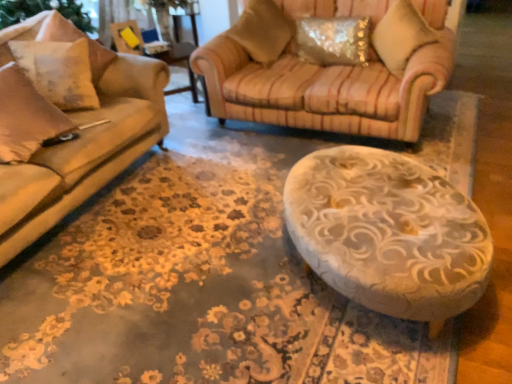
What do you see at coordinates (262, 30) in the screenshot? The height and width of the screenshot is (384, 512). I see `textured beige pillow at upper center, acting as the third pillow starting from the right` at bounding box center [262, 30].

This screenshot has width=512, height=384. I want to click on yellow plastic swivel chair at upper left, so click(x=127, y=37).

The image size is (512, 384). I want to click on sparkly metallic pillow at upper right, which is counted as the second pillow, starting from the right, so click(x=333, y=40).

Is textured beige pillow at upper center, the 2th pillow viewed from the left, smaller than velvet striped pillow at upper right, which appears as the first pillow when viewed from the right?

Actually, textured beige pillow at upper center, the 2th pillow viewed from the left, might be larger than velvet striped pillow at upper right, which appears as the first pillow when viewed from the right.

How many degrees apart are the facing directions of textured beige pillow at upper center, acting as the third pillow starting from the right, and velvet striped pillow at upper right, which appears as the first pillow when viewed from the right?

The facing directions of textured beige pillow at upper center, acting as the third pillow starting from the right, and velvet striped pillow at upper right, which appears as the first pillow when viewed from the right, are 81.5 degrees apart.

Which is farther from the camera, (249, 6) or (372, 33)?

Point (249, 6)

Does textured beige pillow at upper center, the 2th pillow viewed from the left, come in front of velvet striped pillow at upper right, which appears as the first pillow when viewed from the right?

No, textured beige pillow at upper center, the 2th pillow viewed from the left, is behind velvet striped pillow at upper right, which appears as the first pillow when viewed from the right.

Is velvet striped pillow at upper right, which appears as the first pillow when viewed from the right, bigger than textured beige pillow at upper center, the 2th pillow viewed from the left?

Incorrect, velvet striped pillow at upper right, which appears as the first pillow when viewed from the right, is not larger than textured beige pillow at upper center, the 2th pillow viewed from the left.

Which object is positioned more to the right, velvet striped pillow at upper right, which appears as the first pillow when viewed from the right, or textured beige pillow at upper center, the 2th pillow viewed from the left?

Positioned to the right is velvet striped pillow at upper right, which appears as the first pillow when viewed from the right.

Which is in front, point (429, 29) or point (247, 29)?

The point (429, 29) is closer.

Considering the sizes of objects velvet striped pillow at upper right, which appears as the first pillow when viewed from the right, and textured beige pillow at upper center, the 2th pillow viewed from the left, in the image provided, who is taller, velvet striped pillow at upper right, which appears as the first pillow when viewed from the right, or textured beige pillow at upper center, the 2th pillow viewed from the left,?

textured beige pillow at upper center, the 2th pillow viewed from the left.

Considering the sizes of textured beige pillow at upper center, the 2th pillow viewed from the left, and white textured pillow at left, arranged as the 1th pillow when viewed from the left, in the image, is textured beige pillow at upper center, the 2th pillow viewed from the left, wider or thinner than white textured pillow at left, arranged as the 1th pillow when viewed from the left,?

Clearly, textured beige pillow at upper center, the 2th pillow viewed from the left, has more width compared to white textured pillow at left, arranged as the 1th pillow when viewed from the left.

Considering the relative positions of textured beige pillow at upper center, the 2th pillow viewed from the left, and white textured pillow at left, arranged as the 1th pillow when viewed from the left, in the image provided, is textured beige pillow at upper center, the 2th pillow viewed from the left, to the left of white textured pillow at left, arranged as the 1th pillow when viewed from the left, from the viewer's perspective?

Incorrect, textured beige pillow at upper center, the 2th pillow viewed from the left, is not on the left side of white textured pillow at left, arranged as the 1th pillow when viewed from the left.

Between point (265, 17) and point (30, 47), which one is positioned in front?

The point (30, 47) is more forward.

Is textured beige pillow at upper center, the 2th pillow viewed from the left, positioned far away from white textured pillow at left, which is the 4th pillow in right-to-left order?

Yes.

From a real-world perspective, which is physically above, textured beige pillow at upper center, the 2th pillow viewed from the left, or yellow plastic swivel chair at upper left?

yellow plastic swivel chair at upper left.

Who is more distant, textured beige pillow at upper center, the 2th pillow viewed from the left, or yellow plastic swivel chair at upper left?

yellow plastic swivel chair at upper left is more distant.

Who is taller, textured beige pillow at upper center, the 2th pillow viewed from the left, or yellow plastic swivel chair at upper left?

textured beige pillow at upper center, the 2th pillow viewed from the left, is taller.

Does point (251, 19) lie behind point (129, 53)?

No, (251, 19) is closer to viewer.

From a real-world perspective, between velvet striped pillow at upper right, which is the 4th pillow in left-to-right order, and yellow plastic swivel chair at upper left, who is vertically higher?

velvet striped pillow at upper right, which is the 4th pillow in left-to-right order, is physically above.

Considering the positions of objects velvet striped pillow at upper right, which appears as the first pillow when viewed from the right, and yellow plastic swivel chair at upper left in the image provided, who is more to the right, velvet striped pillow at upper right, which appears as the first pillow when viewed from the right, or yellow plastic swivel chair at upper left?

From the viewer's perspective, velvet striped pillow at upper right, which appears as the first pillow when viewed from the right, appears more on the right side.

Is velvet striped pillow at upper right, which appears as the first pillow when viewed from the right, wider than yellow plastic swivel chair at upper left?

Yes.

Which is more to the right, velvet striped pillow at upper right, which is the 4th pillow in left-to-right order, or white textured pillow at left, which is the 4th pillow in right-to-left order?

From the viewer's perspective, velvet striped pillow at upper right, which is the 4th pillow in left-to-right order, appears more on the right side.

Can we say velvet striped pillow at upper right, which appears as the first pillow when viewed from the right, lies outside white textured pillow at left, which is the 4th pillow in right-to-left order?

Indeed, velvet striped pillow at upper right, which appears as the first pillow when viewed from the right, is completely outside white textured pillow at left, which is the 4th pillow in right-to-left order.

Is point (433, 34) closer or farther from the camera than point (47, 80)?

Point (433, 34) is positioned farther from the camera compared to point (47, 80).

In terms of height, does sparkly metallic pillow at upper right, which is counted as the second pillow, starting from the right, look taller or shorter compared to velvet striped pillow at upper right, which is the 4th pillow in left-to-right order?

sparkly metallic pillow at upper right, which is counted as the second pillow, starting from the right, is shorter than velvet striped pillow at upper right, which is the 4th pillow in left-to-right order.

Is sparkly metallic pillow at upper right, which is counted as the second pillow, starting from the right, turned away from velvet striped pillow at upper right, which appears as the first pillow when viewed from the right?

No, velvet striped pillow at upper right, which appears as the first pillow when viewed from the right, is not at the back of sparkly metallic pillow at upper right, which is counted as the second pillow, starting from the right.

Which of these two, sparkly metallic pillow at upper right, which is counted as the second pillow, starting from the right, or velvet striped pillow at upper right, which is the 4th pillow in left-to-right order, is smaller?

sparkly metallic pillow at upper right, which is counted as the second pillow, starting from the right, is smaller.

From a real-world perspective, which object stands above the other?

From a 3D spatial view, velvet striped pillow at upper right, which is the 4th pillow in left-to-right order, is above.

Locate an element on the screen. Image resolution: width=512 pixels, height=384 pixels. pillow that is the 2nd object located in front of the textured beige pillow at upper center, the 2th pillow viewed from the left is located at coordinates pyautogui.click(x=401, y=35).

Image resolution: width=512 pixels, height=384 pixels. In order to click on the 2nd pillow positioned above the textured beige pillow at upper center, the 2th pillow viewed from the left (from a real-world perspective) in this screenshot , I will do `click(401, 35)`.

Considering their positions, is white textured pillow at left, which is the 4th pillow in right-to-left order, positioned closer to velvet striped pillow at upper right, which appears as the first pillow when viewed from the right, than yellow plastic swivel chair at upper left?

Based on the image, yellow plastic swivel chair at upper left appears to be nearer to velvet striped pillow at upper right, which appears as the first pillow when viewed from the right.

Estimate the real-world distances between objects in this image. Which object is closer to yellow plastic swivel chair at upper left, textured beige pillow at upper center, the 2th pillow viewed from the left, or sparkly metallic pillow at upper right, the 3th pillow in the left-to-right sequence?

Based on the image, textured beige pillow at upper center, the 2th pillow viewed from the left, appears to be nearer to yellow plastic swivel chair at upper left.

When comparing their distances from white textured pillow at left, arranged as the 1th pillow when viewed from the left, does velvet striped pillow at upper right, which appears as the first pillow when viewed from the right, or sparkly metallic pillow at upper right, the 3th pillow in the left-to-right sequence, seem closer?

sparkly metallic pillow at upper right, the 3th pillow in the left-to-right sequence, is closer to white textured pillow at left, arranged as the 1th pillow when viewed from the left.

Based on their spatial positions, is textured beige pillow at upper center, acting as the third pillow starting from the right, or yellow plastic swivel chair at upper left closer to sparkly metallic pillow at upper right, the 3th pillow in the left-to-right sequence?

textured beige pillow at upper center, acting as the third pillow starting from the right, is closer to sparkly metallic pillow at upper right, the 3th pillow in the left-to-right sequence.

From the image, which object appears to be farther from velvet striped pillow at upper right, which appears as the first pillow when viewed from the right, sparkly metallic pillow at upper right, which is counted as the second pillow, starting from the right, or white textured pillow at left, which is the 4th pillow in right-to-left order?

white textured pillow at left, which is the 4th pillow in right-to-left order, is positioned further to the anchor velvet striped pillow at upper right, which appears as the first pillow when viewed from the right.

Looking at the image, which one is located closer to white textured pillow at left, which is the 4th pillow in right-to-left order, textured beige pillow at upper center, acting as the third pillow starting from the right, or sparkly metallic pillow at upper right, the 3th pillow in the left-to-right sequence?

textured beige pillow at upper center, acting as the third pillow starting from the right, is closer to white textured pillow at left, which is the 4th pillow in right-to-left order.

When comparing their distances from textured beige pillow at upper center, the 2th pillow viewed from the left, does white textured pillow at left, arranged as the 1th pillow when viewed from the left, or yellow plastic swivel chair at upper left seem closer?

The object closer to textured beige pillow at upper center, the 2th pillow viewed from the left, is yellow plastic swivel chair at upper left.

Looking at this image, which object lies further to the anchor point textured beige pillow at upper center, the 2th pillow viewed from the left, velvet striped pillow at upper right, which is the 4th pillow in left-to-right order, or sparkly metallic pillow at upper right, the 3th pillow in the left-to-right sequence?

Among the two, velvet striped pillow at upper right, which is the 4th pillow in left-to-right order, is located further to textured beige pillow at upper center, the 2th pillow viewed from the left.

I want to click on pillow located between textured beige pillow at upper center, acting as the third pillow starting from the right, and velvet striped pillow at upper right, which appears as the first pillow when viewed from the right, in the left-right direction, so click(333, 40).

This screenshot has width=512, height=384. What are the coordinates of `swivel chair between white textured pillow at left, arranged as the 1th pillow when viewed from the left, and sparkly metallic pillow at upper right, the 3th pillow in the left-to-right sequence, in the horizontal direction` in the screenshot? It's located at (127, 37).

Find the location of a particular element. Image resolution: width=512 pixels, height=384 pixels. swivel chair between white textured pillow at left, arranged as the 1th pillow when viewed from the left, and velvet striped pillow at upper right, which is the 4th pillow in left-to-right order, from left to right is located at coordinates (127, 37).

Identify the location of pillow located between white textured pillow at left, which is the 4th pillow in right-to-left order, and sparkly metallic pillow at upper right, which is counted as the second pillow, starting from the right, in the left-right direction. Image resolution: width=512 pixels, height=384 pixels. (262, 30).